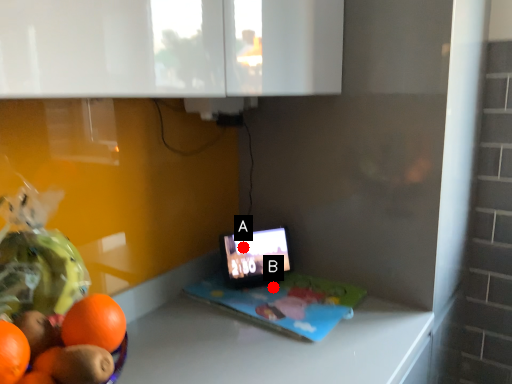
Question: Two points are circled on the image, labeled by A and B beside each circle. Which point is closer to the camera?

Choices:
 (A) A is closer
 (B) B is closer

Answer: (B)